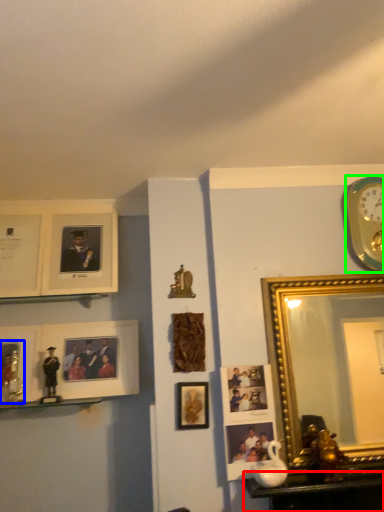
Question: Which object is positioned closest to table (highlighted by a red box)? Select from picture frame (highlighted by a blue box) and wall clock (highlighted by a green box).

Choices:
 (A) picture frame
 (B) wall clock

Answer: (B)